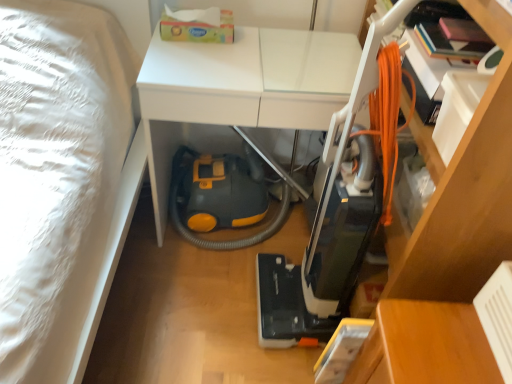
At what (x,y) coordinates should I click in order to perform the action: click on blank space to the left of orange corded vacuum cleaner at center. Please return your answer as a coordinate pair (x, y). Image resolution: width=512 pixels, height=384 pixels. Looking at the image, I should click on (217, 310).